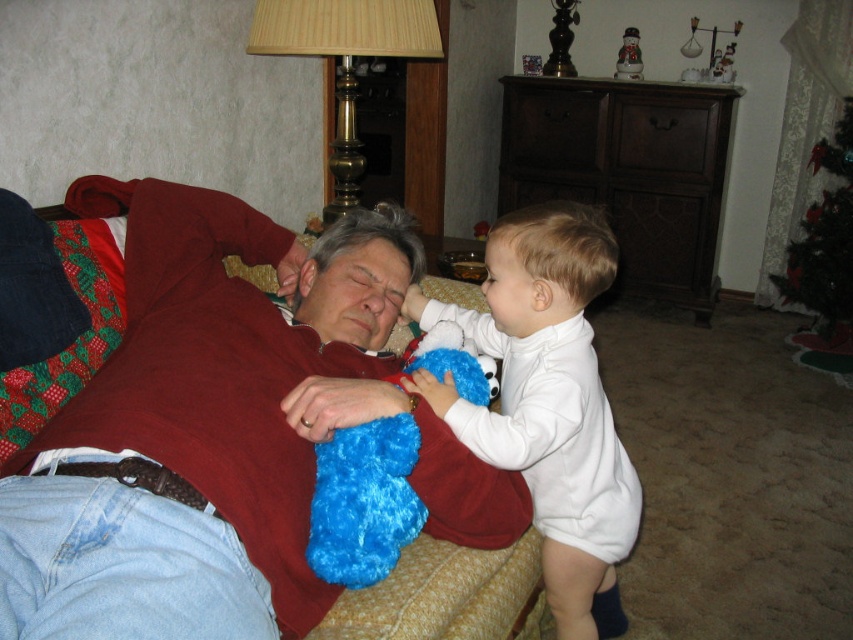
Question: Can you confirm if fuzzy blue stuffed toy at upper center is thinner than green shiny christmas tree at upper right?

Choices:
 (A) no
 (B) yes

Answer: (A)

Question: Does fuzzy blue stuffed toy at upper center have a greater width compared to green shiny christmas tree at upper right?

Choices:
 (A) no
 (B) yes

Answer: (B)

Question: Which point appears closest to the camera in this image?

Choices:
 (A) (822, 317)
 (B) (0, 584)
 (C) (422, 224)

Answer: (B)

Question: Which of these objects is positioned farthest from the white soft onesie at center?

Choices:
 (A) fuzzy blue stuffed toy at upper center
 (B) gold brass lamp at upper center
 (C) green shiny christmas tree at upper right

Answer: (C)

Question: Considering the real-world distances, which object is farthest from the fuzzy blue stuffed toy at upper center?

Choices:
 (A) gold brass lamp at upper center
 (B) white soft onesie at center
 (C) green shiny christmas tree at upper right

Answer: (C)

Question: Can you confirm if fuzzy blue stuffed toy at upper center is positioned below white soft onesie at center?

Choices:
 (A) yes
 (B) no

Answer: (B)